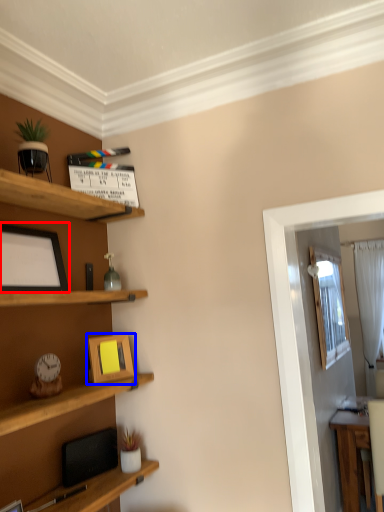
Question: Which point is closer to the camera, picture frame (highlighted by a red box) or picture frame (highlighted by a blue box)?

Choices:
 (A) picture frame
 (B) picture frame

Answer: (A)